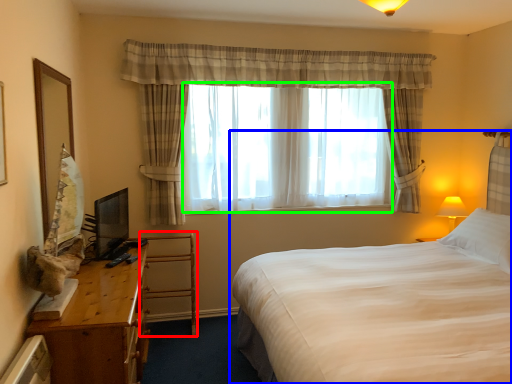
Question: Which is farther away from armchair (highlighted by a red box)? bed (highlighted by a blue box) or bay window (highlighted by a green box)?

Choices:
 (A) bed
 (B) bay window

Answer: (A)